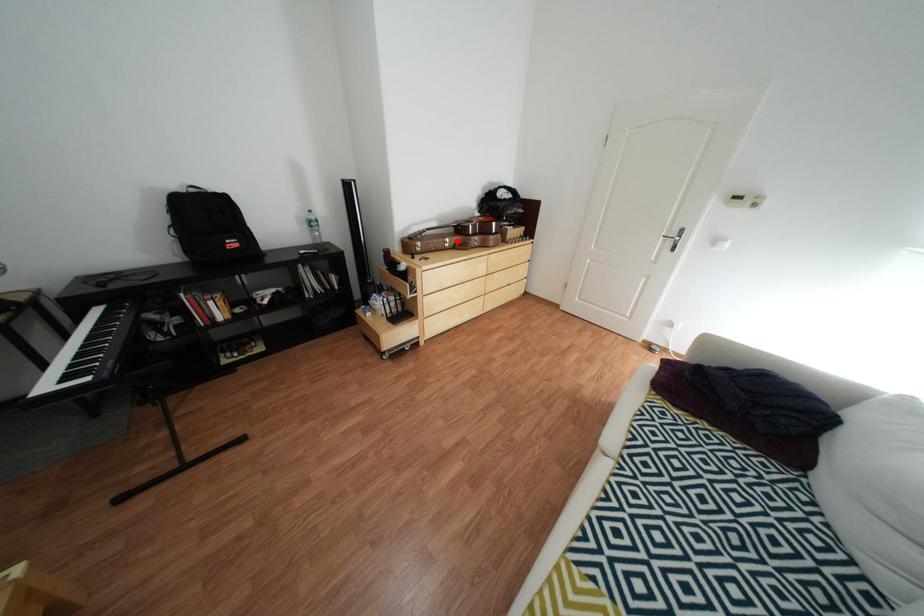
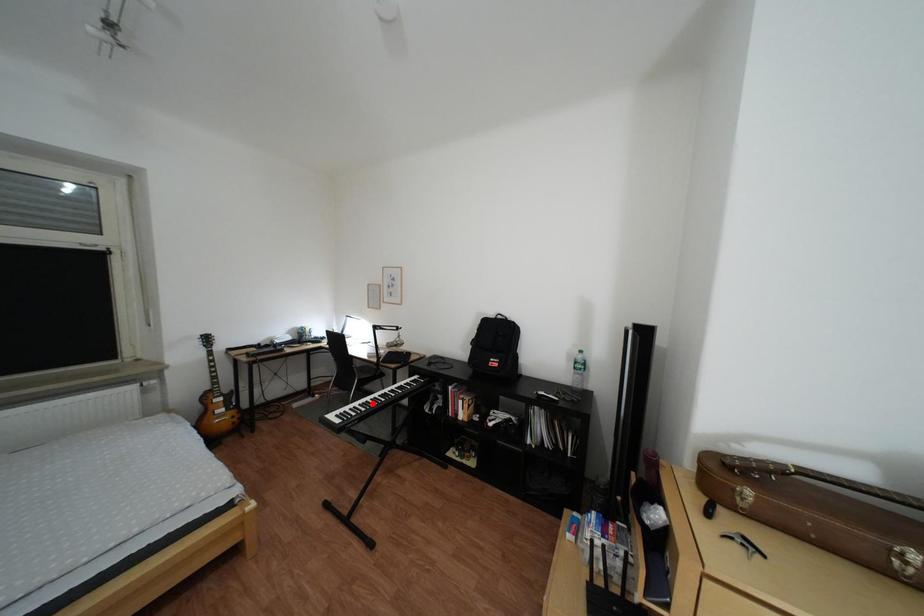
I am providing you with two images of the same scene from different viewpoints. A red point is marked on the first image and another point is marked on the second image. Do the highlighted points in image1 and image2 indicate the same real-world spot?

No